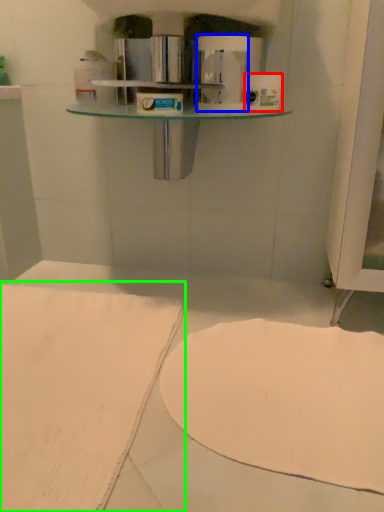
Question: Which is farther away from toilet paper (highlighted by a red box)? toilet paper (highlighted by a blue box) or sheet (highlighted by a green box)?

Choices:
 (A) toilet paper
 (B) sheet

Answer: (B)